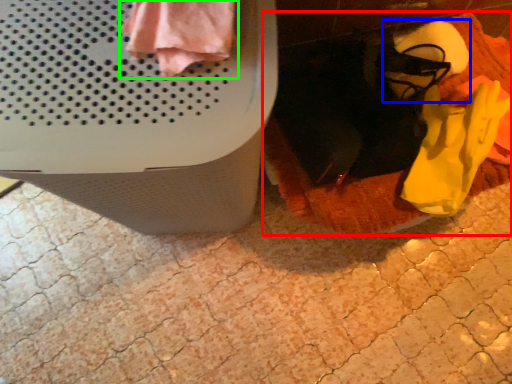
Question: Which object is positioned closest to blanket (highlighted by a red box)? Select from footwear (highlighted by a blue box) and clothing (highlighted by a green box).

Choices:
 (A) footwear
 (B) clothing

Answer: (A)